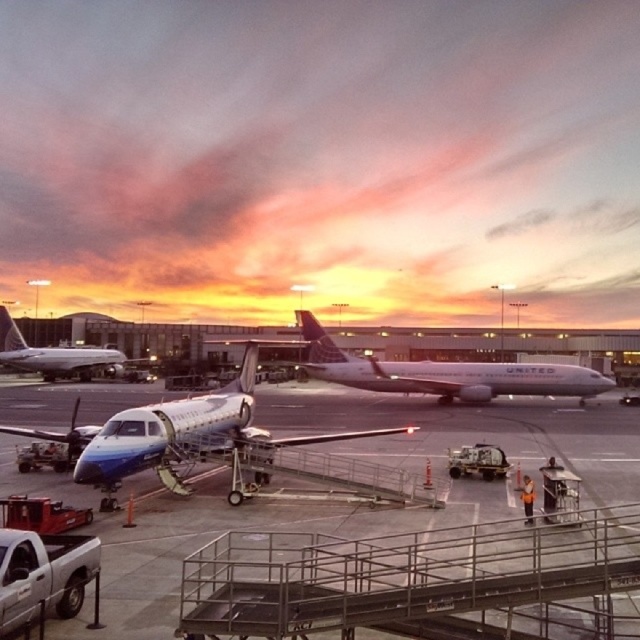
You are a passenger at the airport and need to board your flight. You see a metallic blue airplane at center and a white glossy airliner at center. Which airplane is closer to the jet bridge?

The metallic blue airplane at center is closer to the jet bridge because it is positioned to the left of the white glossy airliner at center, which is further away from the jet bridge.